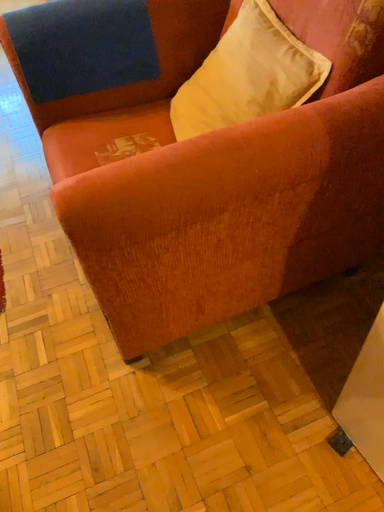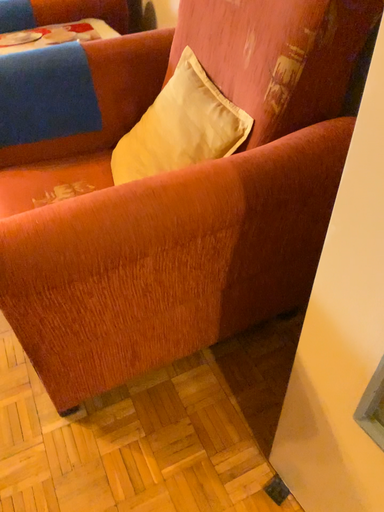
Question: Which way did the camera rotate in the video?

Choices:
 (A) rotated downward
 (B) rotated upward

Answer: (B)